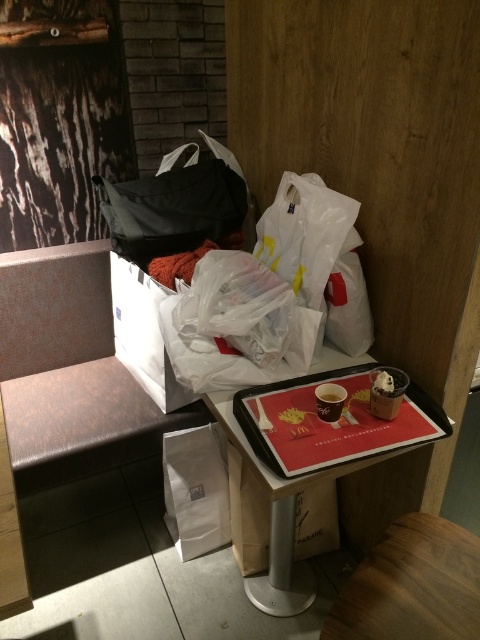
You are a customer at McDonalds and you want to put both the black fabric bag at upper center and the cardboard tray at center into your backpack. Which item should you place first to ensure both fit properly?

The black fabric bag at upper center is bigger than the cardboard tray at center, so you should place the black fabric bag at upper center first to ensure both items fit properly.

In the scene shown: You are sitting at the dining area and want to grab your black fabric bag at upper center and the cardboard tray at center. Which item is closer to you?

The black fabric bag at upper center is closer to you since it is further to the viewer than the cardboard tray at center.

You are a customer at McDonalds holding a 4 foot long umbrella. You want to place it on the table without it touching the translucent plastic bag at center. Is this possible?

The translucent plastic bag at center is 3.97 feet from the camera. Since your umbrella is 4 feet long, you can place it on the table so that the tip of the umbrella extends beyond the bag while keeping the handle near the bag, ensuring it doesn,t touch the bag as the distance allows for placement.